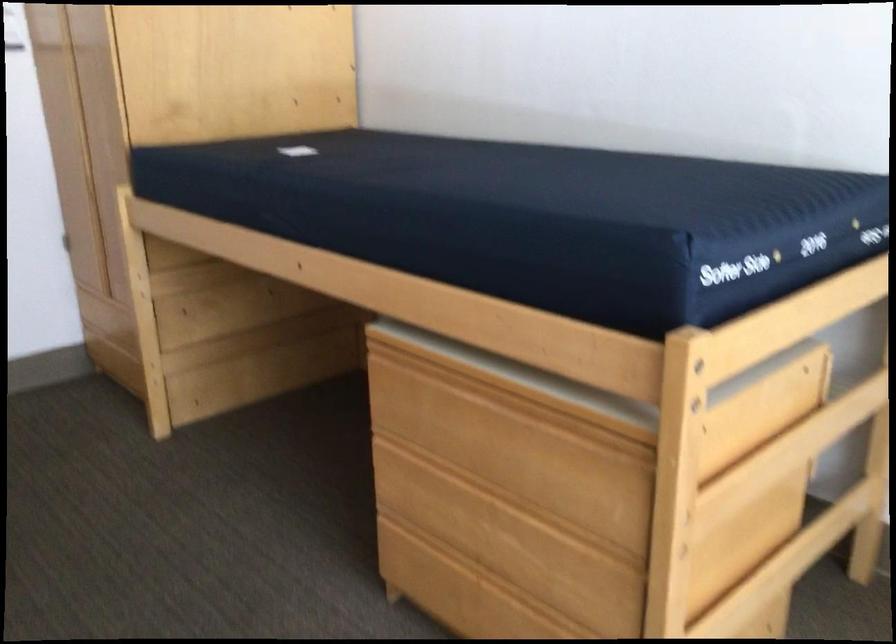
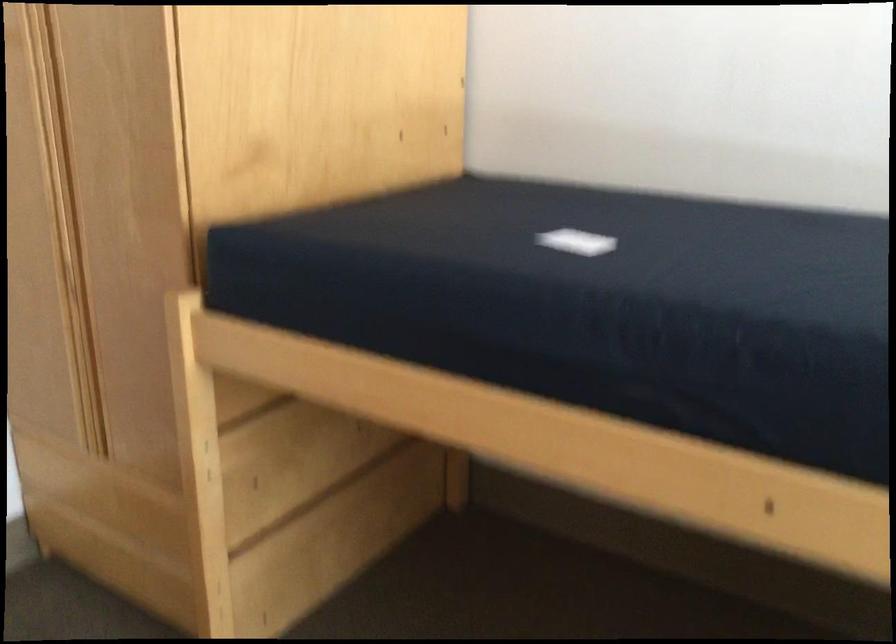
In a continuous first-person perspective shot, in which direction is the camera moving?

The cameraman moved toward left, forward.